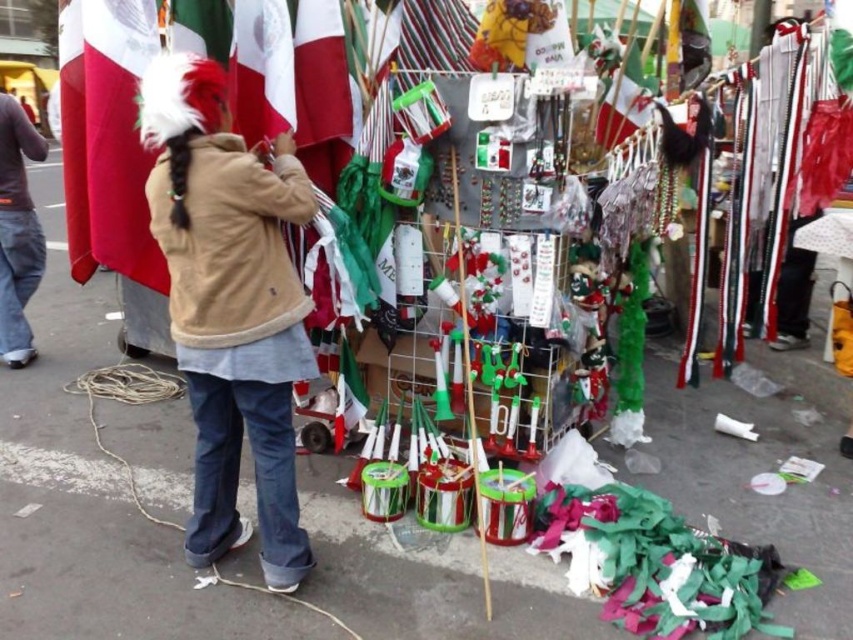
In the scene shown: You are a customer at the vendor stall. You want to pick up the matte green flag at upper center but first need to reach the denim jeans at left. Which item is closer to you when standing in front of the stall?

The denim jeans at left is closer to you than the matte green flag at upper center because it is to the left of it.

You are a delivery robot with a 1.5 meter wide package. You need to navigate between the beige fleece jacket at center and the denim jeans at left. Can you fit through the space between them?

The beige fleece jacket at center and denim jeans at left are 2.13 meters apart from each other, so yes, the robot can fit through the space between them since the distance is wider than the package.